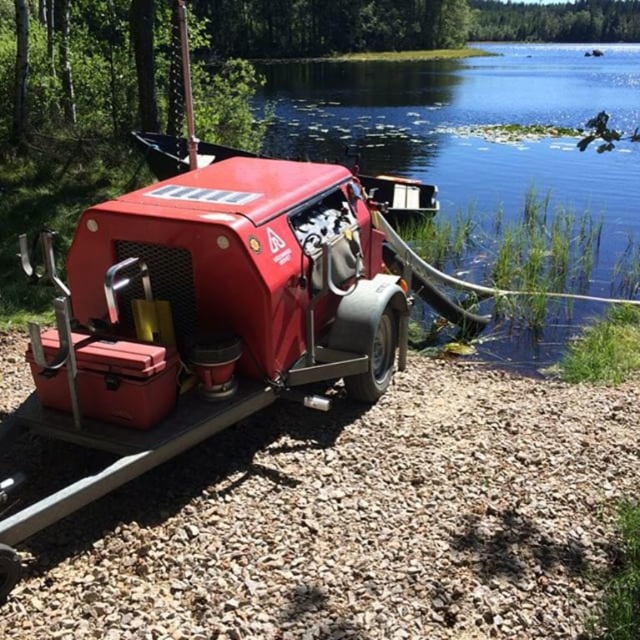
Who is more forward, (216, 602) or (394, 104)?

Point (216, 602)

Can you confirm if smooth gravel shore at lower right is positioned below clear water at lower right?

Indeed, smooth gravel shore at lower right is positioned under clear water at lower right.

Locate an element on the screen. smooth gravel shore at lower right is located at coordinates (356, 522).

I want to click on smooth gravel shore at lower right, so click(356, 522).